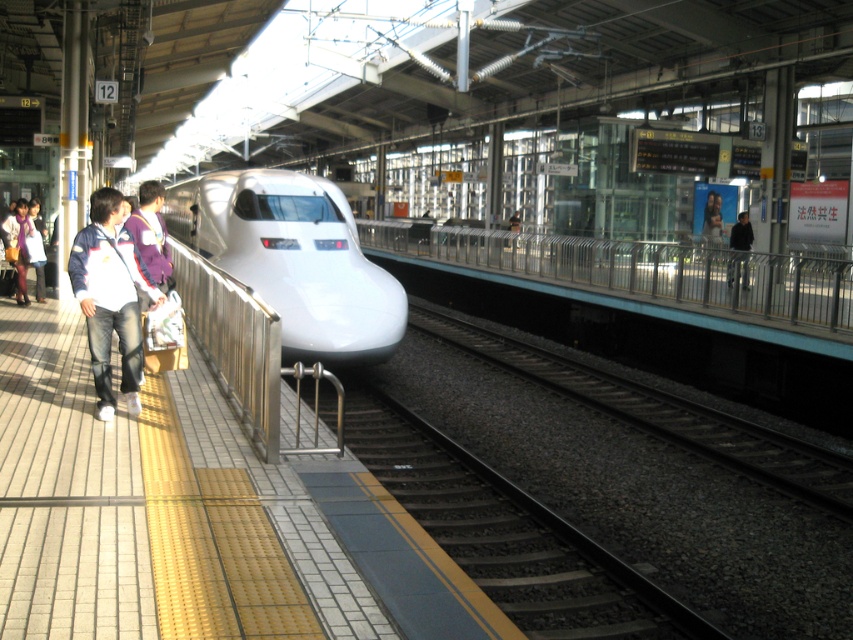
Is white cotton jacket at left below matte white jacket at left?

Correct, white cotton jacket at left is located below matte white jacket at left.

Does white cotton jacket at left appear on the left side of matte white jacket at left?

In fact, white cotton jacket at left is to the right of matte white jacket at left.

Is point (100, 296) in front of point (25, 220)?

That is True.

This screenshot has height=640, width=853. Find the location of `white cotton jacket at left`. white cotton jacket at left is located at coordinates (109, 296).

Is matte white jacket at left thinner than dark blue jacket at right?

Correct, matte white jacket at left's width is less than dark blue jacket at right's.

Which of these two, matte white jacket at left or dark blue jacket at right, stands shorter?

matte white jacket at left is shorter.

Does point (20, 280) come behind point (740, 221)?

No.

This screenshot has height=640, width=853. Identify the location of matte white jacket at left. 16,244.

Does point (461, 252) come closer to viewer compared to point (99, 220)?

No, it is behind (99, 220).

Does metallic silver rail at center appear on the right side of white cotton jacket at left?

Yes, metallic silver rail at center is to the right of white cotton jacket at left.

What are the coordinates of `metallic silver rail at center` in the screenshot? It's located at (646, 278).